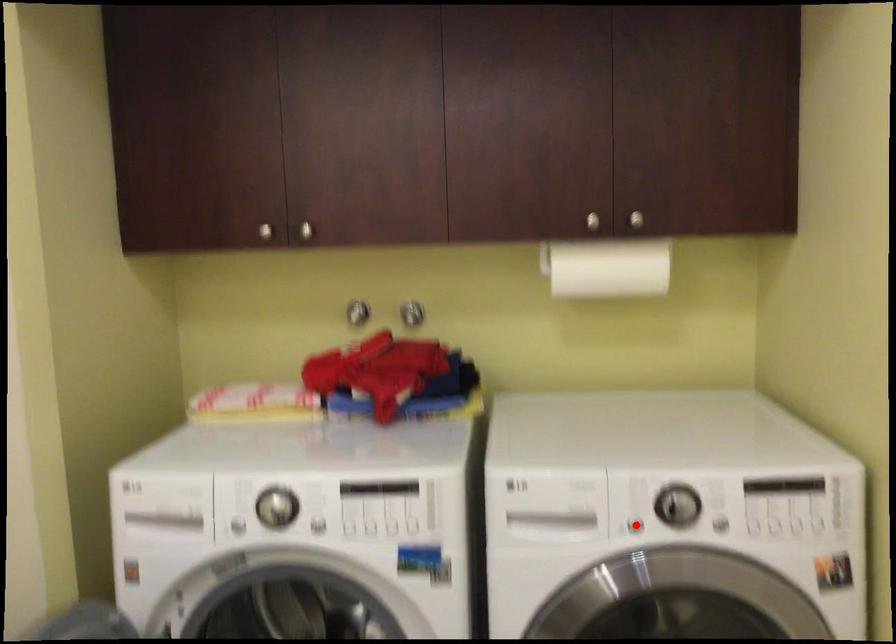
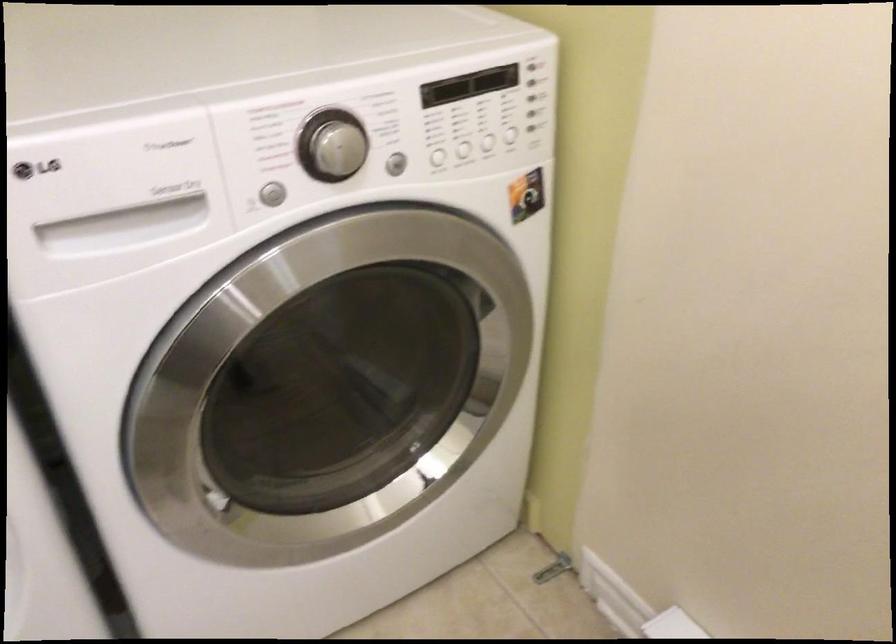
Find the pixel in the second image that matches the highlighted location in the first image.

(269, 194)